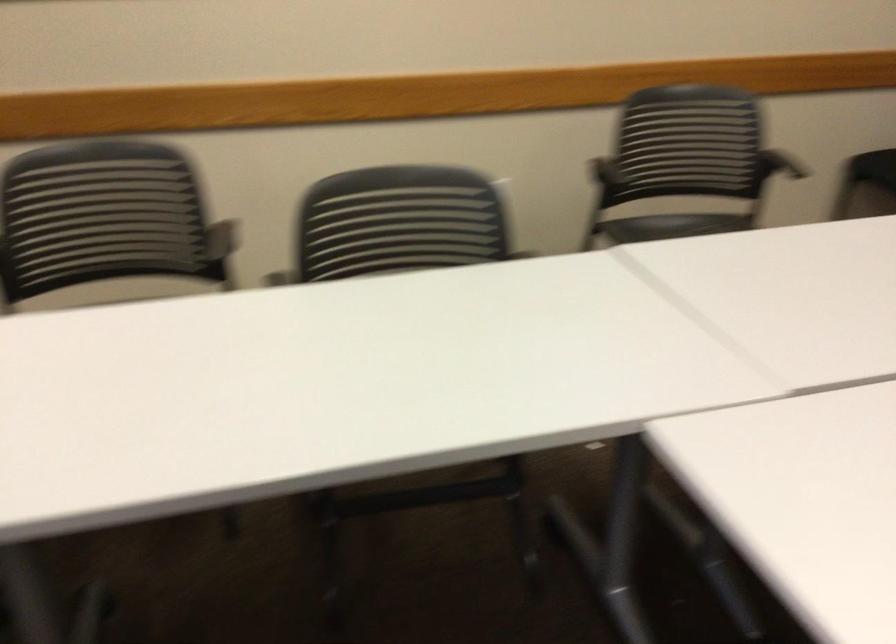
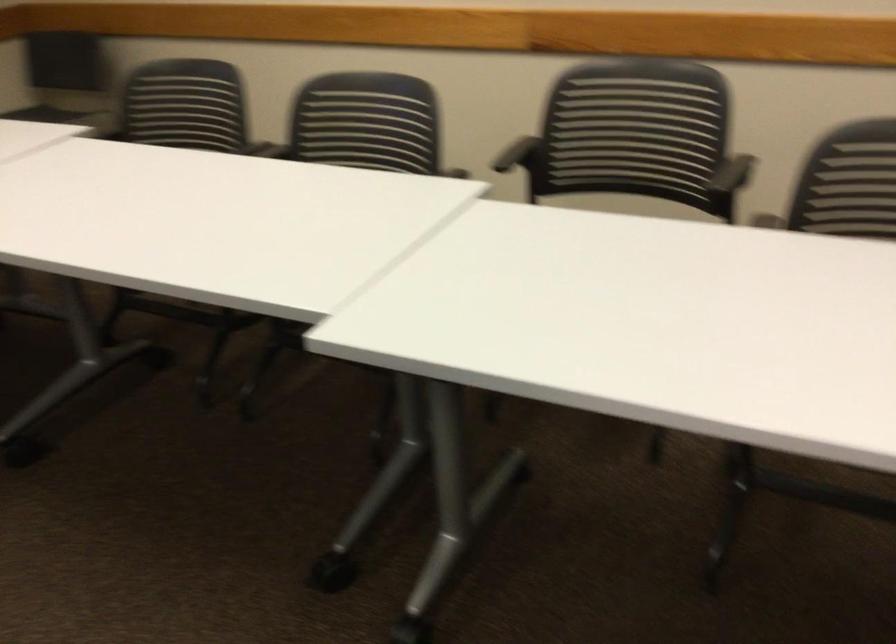
Question: The camera is either moving clockwise (left) or counter-clockwise (right) around the object. The first image is from the beginning of the video and the second image is from the end. Is the camera moving left or right when shooting the video?

Choices:
 (A) Left
 (B) Right

Answer: (B)